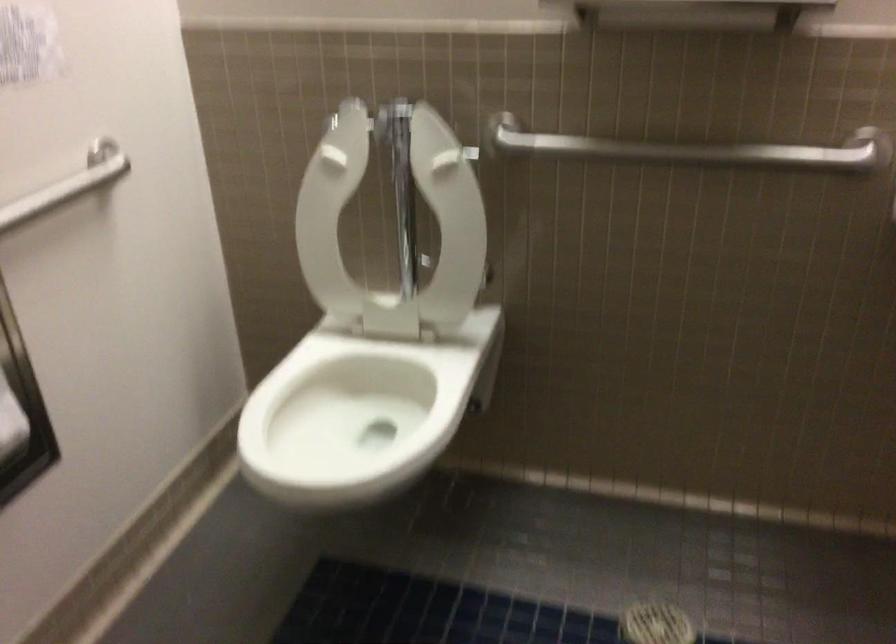
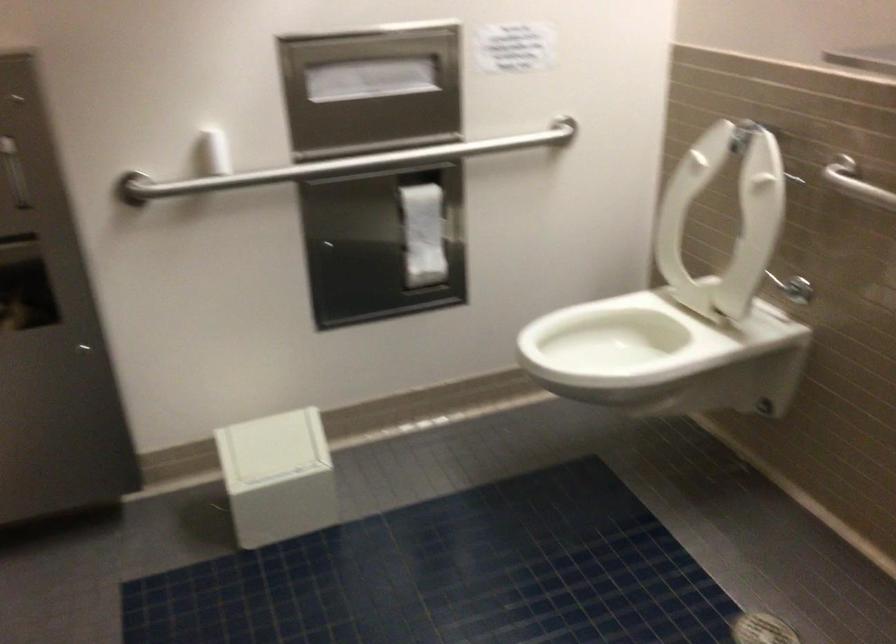
Question: Based on the continuous images, in which direction is the camera rotating? Reply with the corresponding letter.

Choices:
 (A) Left
 (B) Right
 (C) Up
 (D) Down

Answer: (A)